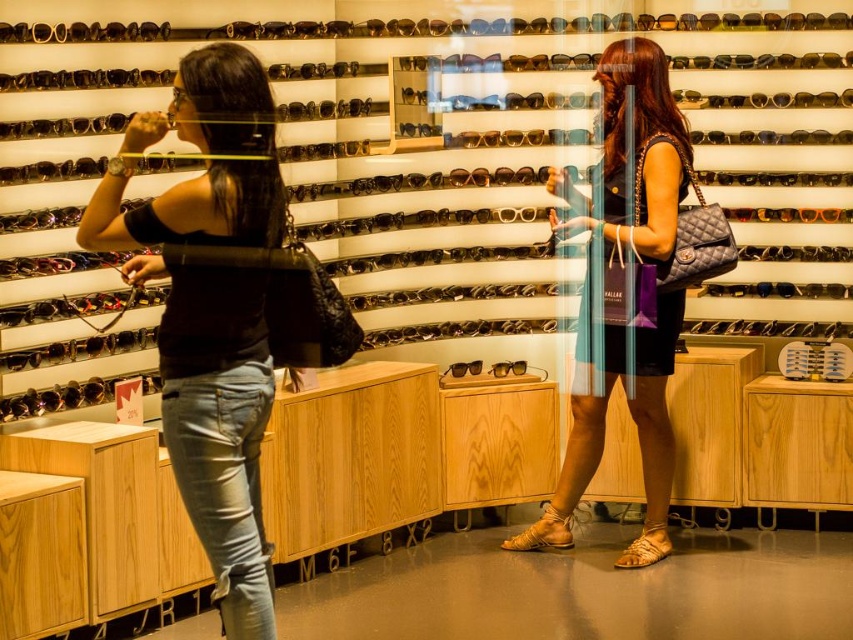
You are a salesperson in the sunglass store and need to arrange two items on a shelf. The items are the matte black top at left and the matte black dress at center. Which item should you place first if you want to maximize shelf space utilization?

The matte black dress at center should be placed first because it occupies more space than the matte black top at left, allowing for better space utilization.

You are standing at point point (209,138) and want to take a photo of the camera. Can you reach the camera from your current position without moving?

The distance between point (209,138) and the camera is 2.42 meters. Since you can extend your arm or use a device to reach further, it might be possible to take the photo without moving, but it depends on your reach capability.

You are a customer in the sunglass store and you want to ask the woman in the matte black top at left about a pair of sunglasses. Where should you approach her from?

The matte black top at left is positioned at point 0.666 on the x axis and 0.257 on the y axis, so you should approach her from the right side since she is on the left side of the image.